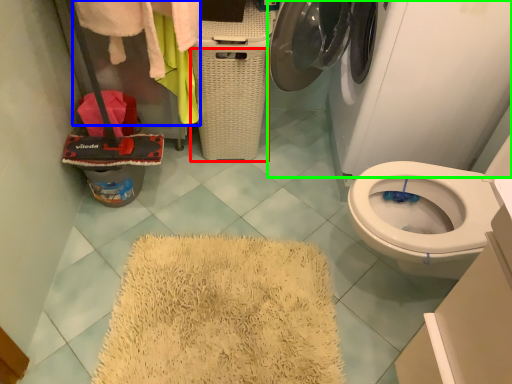
Question: Which is farther away from basket (highlighted by a red box)? clothing (highlighted by a blue box) or washing machine (highlighted by a green box)?

Choices:
 (A) clothing
 (B) washing machine

Answer: (B)